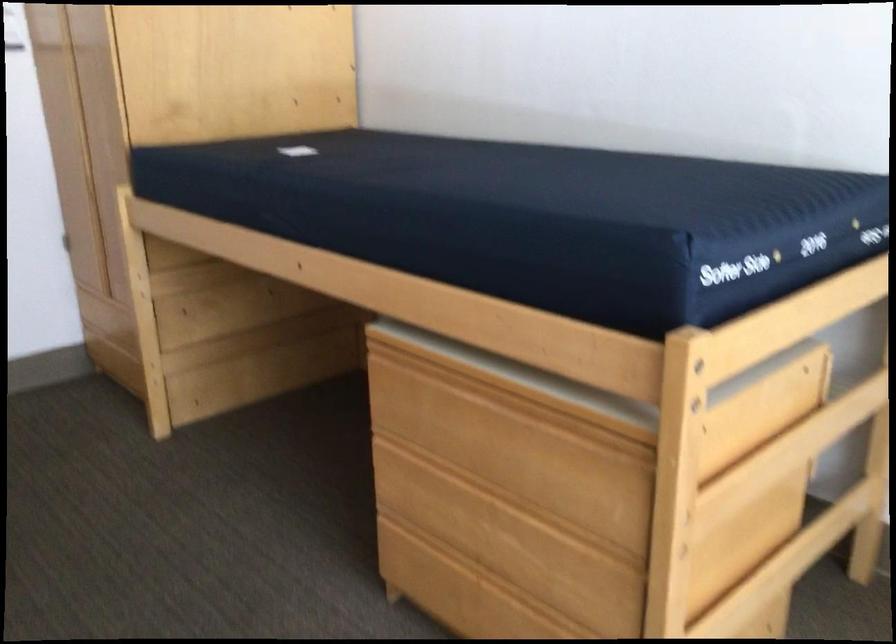
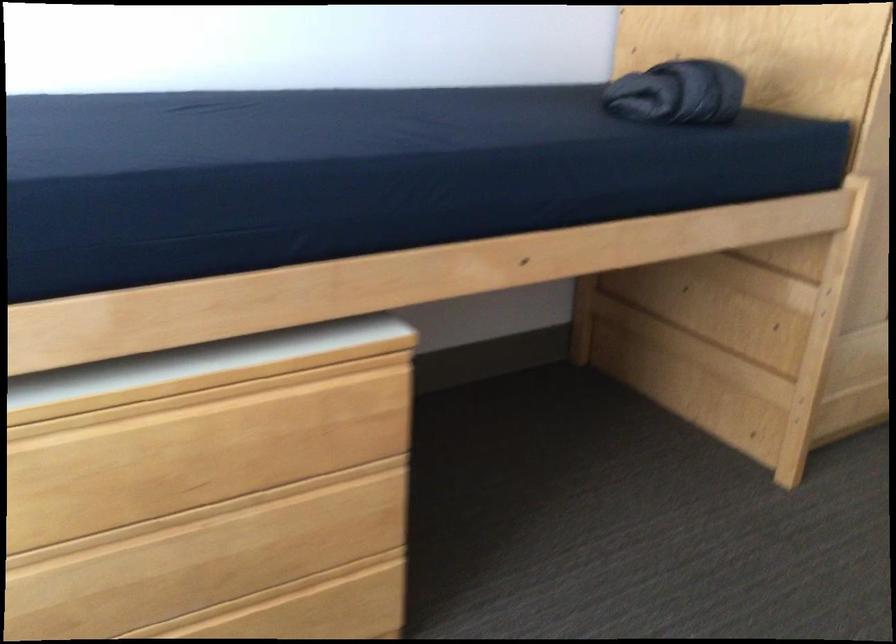
First-person continuous shooting, in which direction is the camera rotating?

The rotation direction of the camera is left-down.